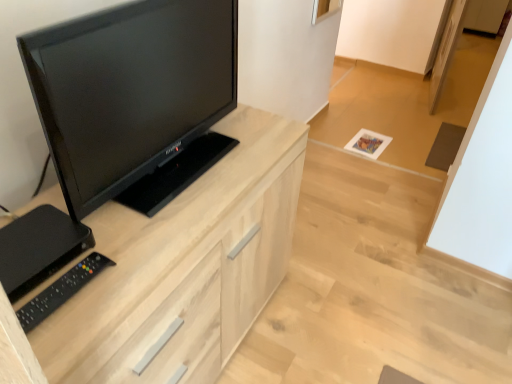
Question: Is the depth of black glossy tv at left greater than that of light wood cabinet at center?

Choices:
 (A) yes
 (B) no

Answer: (B)

Question: Considering the relative sizes of black glossy tv at left and light wood cabinet at center in the image provided, is black glossy tv at left shorter than light wood cabinet at center?

Choices:
 (A) yes
 (B) no

Answer: (A)

Question: Would you say light wood cabinet at center is part of black glossy tv at left's contents?

Choices:
 (A) yes
 (B) no

Answer: (B)

Question: Can you confirm if black glossy tv at left is positioned to the left of light wood cabinet at center?

Choices:
 (A) no
 (B) yes

Answer: (A)

Question: Is black glossy tv at left thinner than light wood cabinet at center?

Choices:
 (A) no
 (B) yes

Answer: (B)

Question: From the image's perspective, relative to black glossy tv at left, is light wood cabinet at center above or below?

Choices:
 (A) above
 (B) below

Answer: (B)

Question: Looking at their shapes, would you say light wood cabinet at center is wider or thinner than black glossy tv at left?

Choices:
 (A) wide
 (B) thin

Answer: (A)

Question: Considering the positions of light wood cabinet at center and black glossy tv at left in the image, is light wood cabinet at center taller or shorter than black glossy tv at left?

Choices:
 (A) short
 (B) tall

Answer: (B)

Question: Visually, is light wood cabinet at center positioned to the left or to the right of black glossy tv at left?

Choices:
 (A) right
 (B) left

Answer: (B)

Question: Do you think light wood cabinet at center is within black plastic remote at lower left, or outside of it?

Choices:
 (A) outside
 (B) inside

Answer: (A)

Question: From a real-world perspective, is light wood cabinet at center above or below black plastic remote at lower left?

Choices:
 (A) above
 (B) below

Answer: (B)

Question: Considering the positions of point (154, 292) and point (49, 296), is point (154, 292) closer or farther from the camera than point (49, 296)?

Choices:
 (A) farther
 (B) closer

Answer: (A)

Question: Looking at their shapes, would you say light wood cabinet at center is wider or thinner than black plastic remote at lower left?

Choices:
 (A) wide
 (B) thin

Answer: (A)

Question: Considering the positions of black glossy tv at left and light wood cabinet at center in the image, is black glossy tv at left taller or shorter than light wood cabinet at center?

Choices:
 (A) short
 (B) tall

Answer: (A)

Question: Considering the positions of point (84, 114) and point (101, 372), is point (84, 114) closer or farther from the camera than point (101, 372)?

Choices:
 (A) farther
 (B) closer

Answer: (A)